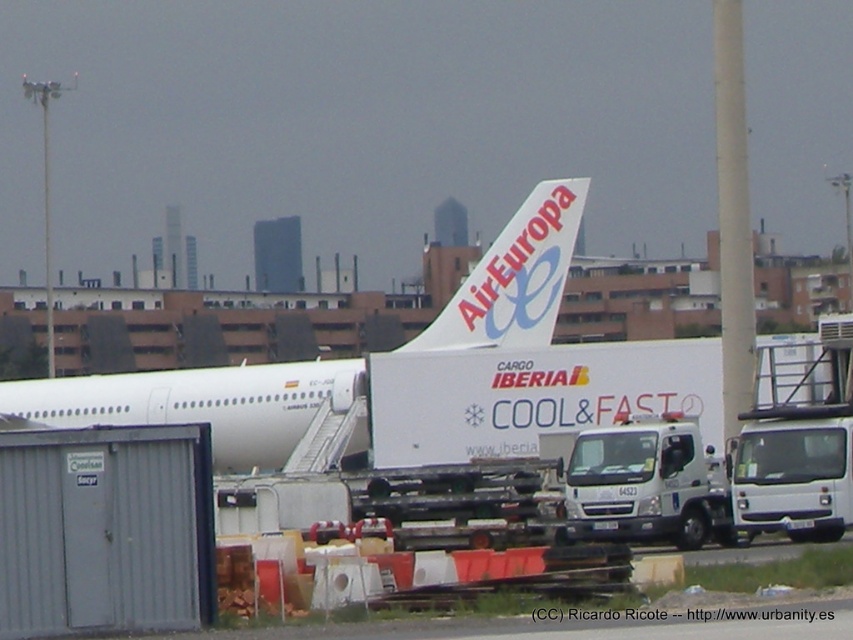
Question: Which point is closer to the camera?

Choices:
 (A) (416, 337)
 (B) (221, 460)
 (C) (674, 492)

Answer: (C)

Question: Can you confirm if white matte airplane at center is positioned below white matte airplane tail at center?

Choices:
 (A) no
 (B) yes

Answer: (B)

Question: Can you confirm if white metallic truck at lower center is thinner than white matte airplane tail at center?

Choices:
 (A) no
 (B) yes

Answer: (B)

Question: Does white metallic truck at lower center appear on the right side of white matte airplane tail at center?

Choices:
 (A) no
 (B) yes

Answer: (B)

Question: Which object is farther from the camera taking this photo?

Choices:
 (A) white matte airplane tail at center
 (B) white matte airplane at center

Answer: (A)

Question: Which point is farther to the camera?

Choices:
 (A) (566, 196)
 (B) (523, 228)
 (C) (711, 499)

Answer: (B)